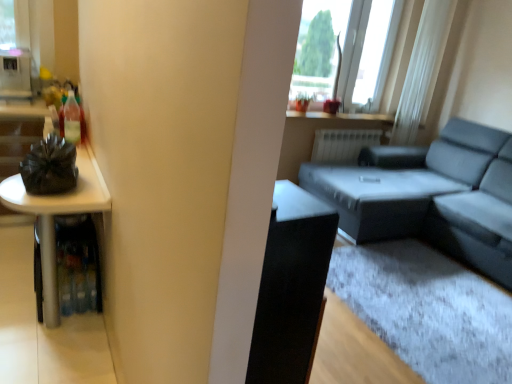
Find the location of a particular element. This screenshot has width=512, height=384. matte gray couch at right is located at coordinates (430, 195).

Find the location of a particular element. The image size is (512, 384). white glossy table at left is located at coordinates (58, 213).

Find the location of a particular element. white sheer curtain at upper right is located at coordinates (422, 70).

This screenshot has height=384, width=512. Find the location of `transparent glass window at upper right`. transparent glass window at upper right is located at coordinates (367, 47).

Based on the photo, does white glossy table at left have a greater width compared to white sheer curtain at upper right?

Correct, the width of white glossy table at left exceeds that of white sheer curtain at upper right.

In order to click on table in front of the white sheer curtain at upper right in this screenshot , I will do `click(58, 213)`.

Which object is further away from the camera, white glossy table at left or white sheer curtain at upper right?

white sheer curtain at upper right is behind.

Looking at their sizes, would you say transparent glass window at upper right is wider or thinner than matte gray couch at right?

Considering their sizes, transparent glass window at upper right looks slimmer than matte gray couch at right.

Is matte gray couch at right inside transparent glass window at upper right?

No, matte gray couch at right is located outside of transparent glass window at upper right.

The image size is (512, 384). I want to click on studio couch that is on the right side of transparent glass window at upper right, so click(430, 195).

Is transparent glass window at upper right oriented towards matte gray couch at right?

Yes.

Based on their positions, is matte gray couch at right located to the left or right of transparent glass window at upper right?

matte gray couch at right is positioned on transparent glass window at upper right's right side.

Is matte gray couch at right touching transparent glass window at upper right?

No, matte gray couch at right is not beside transparent glass window at upper right.

How many degrees apart are the facing directions of matte gray couch at right and transparent glass window at upper right?

The angle between the facing direction of matte gray couch at right and the facing direction of transparent glass window at upper right is 90 degrees.

Is matte gray couch at right closer to the viewer compared to transparent glass window at upper right?

Yes, matte gray couch at right is in front of transparent glass window at upper right.

From a real-world perspective, who is located lower, matte gray couch at right or white sheer curtain at upper right?

matte gray couch at right, from a real-world perspective.

Image resolution: width=512 pixels, height=384 pixels. In the image, there is a matte gray couch at right. Identify the location of curtain above it (from the image's perspective). (422, 70).

Which is behind, matte gray couch at right or white sheer curtain at upper right?

white sheer curtain at upper right.

What's the angular difference between matte gray couch at right and white sheer curtain at upper right's facing directions?

90 degrees.

Consider the image. Which of these two, transparent glass window at upper right or white glossy table at left, is wider?

white glossy table at left is wider.

Does transparent glass window at upper right have a smaller size compared to white glossy table at left?

Yes.

Between transparent glass window at upper right and white glossy table at left, which one appears on the left side from the viewer's perspective?

Positioned to the left is white glossy table at left.

Does point (370, 69) lie in front of point (94, 158)?

That is False.

Would you say white sheer curtain at upper right is to the left or to the right of white glossy refrigerator at upper left in the picture?

Clearly, white sheer curtain at upper right is on the right of white glossy refrigerator at upper left in the image.

What's the angular difference between white sheer curtain at upper right and white glossy refrigerator at upper left's facing directions?

0.000191 degrees.

Between white sheer curtain at upper right and white glossy refrigerator at upper left, which one has more height?

With more height is white sheer curtain at upper right.

In the image, is white sheer curtain at upper right positioned in front of or behind white glossy refrigerator at upper left?

Visually, white sheer curtain at upper right is located behind white glossy refrigerator at upper left.

Considering the positions of objects transparent glass window at upper right and white sheer curtain at upper right in the image provided, who is behind, transparent glass window at upper right or white sheer curtain at upper right?

white sheer curtain at upper right is further away from the camera.

From the image's perspective, relative to white sheer curtain at upper right, is transparent glass window at upper right above or below?

From the image's perspective, transparent glass window at upper right appears below white sheer curtain at upper right.

The image size is (512, 384). What are the coordinates of `curtain above the transparent glass window at upper right (from a real-world perspective)` in the screenshot? It's located at (422, 70).

Is point (341, 29) farther from camera compared to point (429, 66)?

No, (341, 29) is in front of (429, 66).

Identify the location of curtain above the white glossy table at left (from the image's perspective). This screenshot has height=384, width=512. (422, 70).

You are a GUI agent. You are given a task and a screenshot of the screen. Output one action in this format:
    pyautogui.click(x=<x>, y=<y>)
    Task: Click on the studio couch that is under the transparent glass window at upper right (from a real-world perspective)
    
    Given the screenshot: What is the action you would take?
    pyautogui.click(x=430, y=195)

Which object lies nearer to the anchor point white glossy table at left, matte gray couch at right or transparent glass window at upper right?

matte gray couch at right lies closer to white glossy table at left than the other object.

Looking at this image, based on their spatial positions, is white glossy table at left or white glossy refrigerator at upper left closer to matte gray couch at right?

white glossy table at left lies closer to matte gray couch at right than the other object.

Considering their positions, is matte gray couch at right positioned further to transparent glass window at upper right than white sheer curtain at upper right?

matte gray couch at right lies further to transparent glass window at upper right than the other object.

Based on their spatial positions, is matte gray couch at right or white glossy refrigerator at upper left further from transparent glass window at upper right?

white glossy refrigerator at upper left.

Based on their spatial positions, is matte gray couch at right or transparent glass window at upper right closer to white glossy refrigerator at upper left?

transparent glass window at upper right.

Estimate the real-world distances between objects in this image. Which object is closer to transparent glass window at upper right, white glossy refrigerator at upper left or white sheer curtain at upper right?

white sheer curtain at upper right.

Which object lies nearer to the anchor point matte gray couch at right, white glossy refrigerator at upper left or white glossy table at left?

white glossy table at left is positioned closer to the anchor matte gray couch at right.

Considering their positions, is transparent glass window at upper right positioned further to matte gray couch at right than white glossy table at left?

white glossy table at left is further to matte gray couch at right.

At what (x,y) coordinates should I click in order to perform the action: click on window between matte gray couch at right and white sheer curtain at upper right in the front-back direction. Please return your answer as a coordinate pair (x, y). Looking at the image, I should click on (367, 47).

Image resolution: width=512 pixels, height=384 pixels. I want to click on studio couch between white glossy table at left and white sheer curtain at upper right in the horizontal direction, so click(430, 195).

Locate an element on the screen. window between white glossy table at left and matte gray couch at right is located at coordinates (367, 47).

Identify the location of window situated between white glossy refrigerator at upper left and white sheer curtain at upper right from left to right. (367, 47).